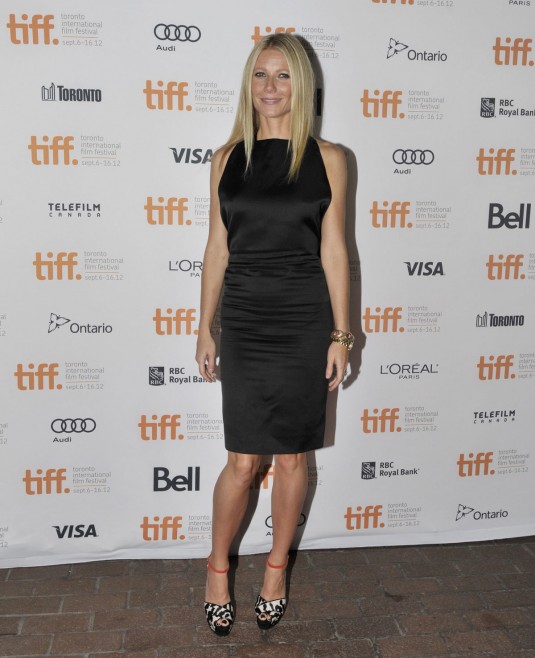
Find the location of a particular element. The height and width of the screenshot is (658, 535). brick floor is located at coordinates (88, 610), (419, 590).